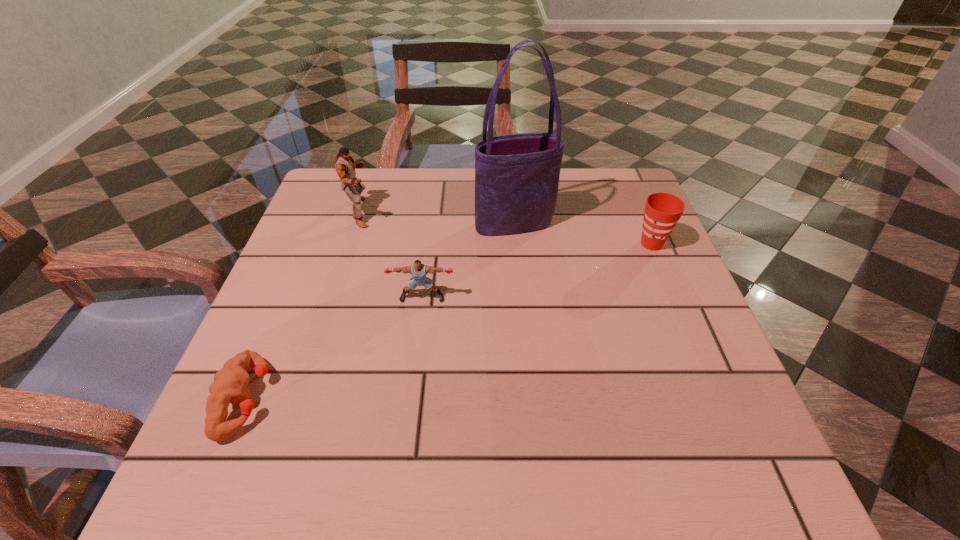
Where is `free spot between the nearest object and the cup`? The image size is (960, 540). free spot between the nearest object and the cup is located at coordinates (449, 321).

Identify the location of free space between the shortest puncher and the second nearest puncher. (334, 348).

Find the location of a particular element. This screenshot has width=960, height=540. free point between the cup and the third object from left to right is located at coordinates (537, 271).

Locate an element on the screen. free space between the second object from right to left and the rightmost object is located at coordinates (583, 234).

Choose which object is the third nearest neighbor to the nearest object. Please provide its 2D coordinates. Your answer should be formatted as a tuple, i.e. [(x, y)], where the tuple contains the x and y coordinates of a point satisfying the conditions above.

[(517, 176)]

Locate an element on the screen. object that is the closest to the rightmost object is located at coordinates (517, 176).

At what (x,y) coordinates should I click in order to perform the action: click on puncher that is the second closest to the second nearest object. Please return your answer as a coordinate pair (x, y). The width and height of the screenshot is (960, 540). Looking at the image, I should click on (345, 165).

Locate which puncher ranks in proximity to the nearest object. Please provide its 2D coordinates. Your answer should be formatted as a tuple, i.e. [(x, y)], where the tuple contains the x and y coordinates of a point satisfying the conditions above.

[(418, 270)]

I want to click on free spot that satisfies the following two spatial constraints: 1. on the front-facing side of the second farthest puncher; 2. with the gloves of the nearest puncher facing forward, so click(410, 399).

The width and height of the screenshot is (960, 540). Identify the location of free spot that satisfies the following two spatial constraints: 1. on the front-facing side of the tallest puncher; 2. on the left side of the tote bag. (356, 224).